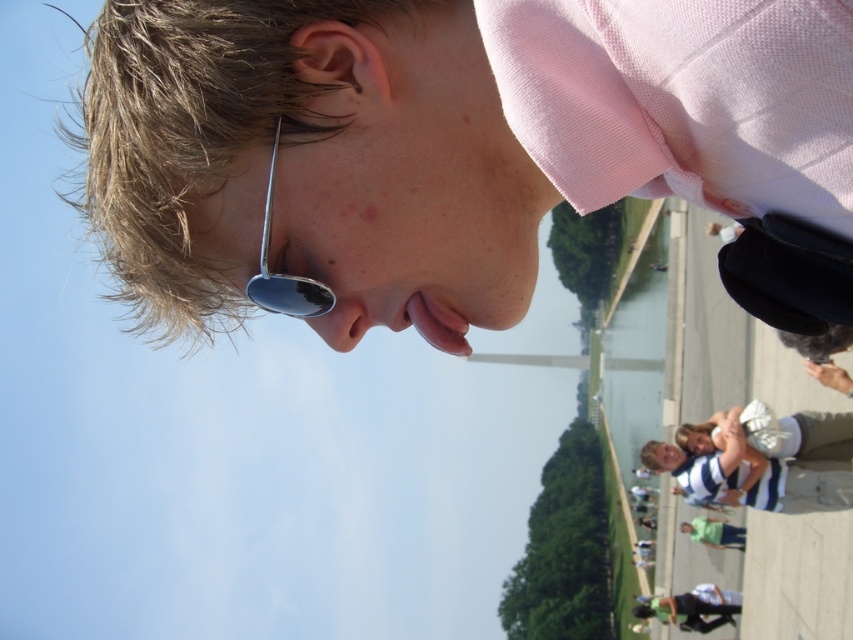
You are a photographer trying to capture a portrait of the person wearing the pink cotton shirt at upper center and the metallic reflective sunglasses at center. Since the sunglasses might reflect the camera, where should you position the camera relative to the person to avoid glare in the sunglasses?

The pink cotton shirt at upper center is positioned on the right side of metallic reflective sunglasses at center. To avoid glare in the metallic reflective sunglasses at center, position the camera to the left side of the person so that the light reflects away from the camera lens.